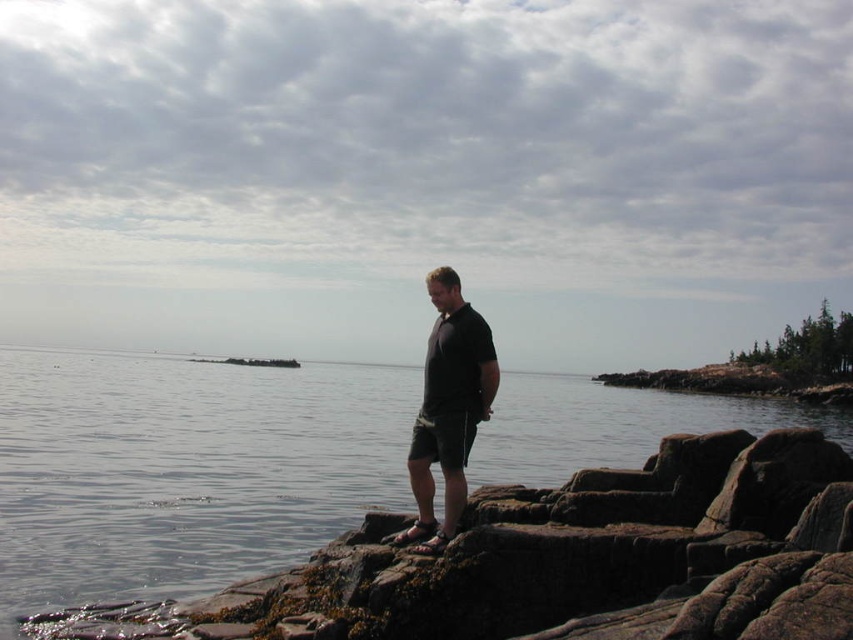
Question: Which object is closer to the camera taking this photo?

Choices:
 (A) clear water at center
 (B) black matte shorts at center

Answer: (A)

Question: Is clear water at center bigger than black matte shorts at center?

Choices:
 (A) no
 (B) yes

Answer: (B)

Question: Is the position of clear water at center less distant than that of black matte shorts at center?

Choices:
 (A) no
 (B) yes

Answer: (B)

Question: Is clear water at center below black matte shorts at center?

Choices:
 (A) no
 (B) yes

Answer: (B)